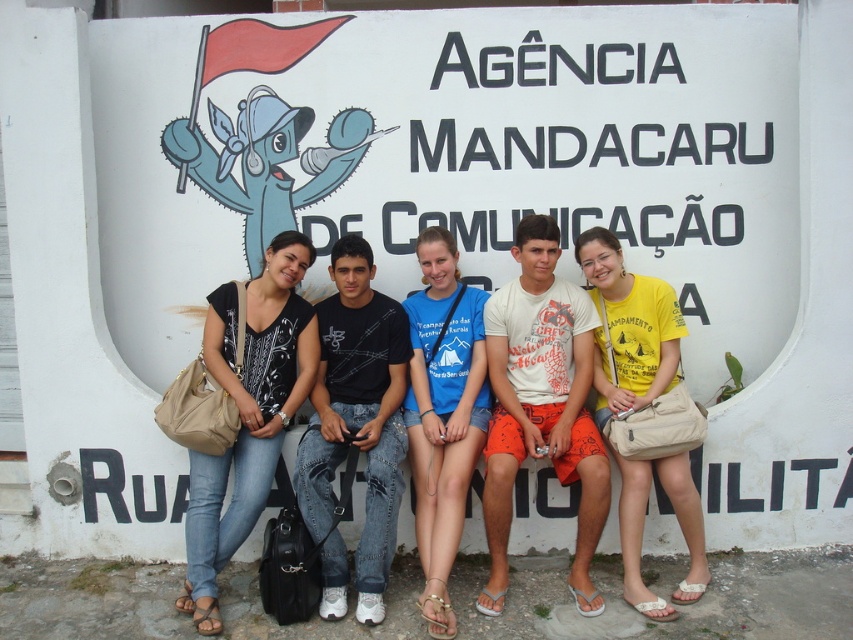
Which is more to the left, black cotton shirt at center or yellow cotton shirt at center?

Positioned to the left is black cotton shirt at center.

Does point (399, 403) lie in front of point (602, 234)?

Yes.

Who is more forward, (x=389, y=465) or (x=627, y=490)?

Point (x=389, y=465) is in front.

In order to click on black cotton shirt at center in this screenshot , I will do `click(355, 428)`.

Looking at this image, between blue cotton t-shirt at center and yellow cotton shirt at center, which one has more height?

Standing taller between the two is blue cotton t-shirt at center.

Is the position of blue cotton t-shirt at center more distant than that of yellow cotton shirt at center?

No, it is in front of yellow cotton shirt at center.

At what (x,y) coordinates should I click in order to perform the action: click on blue cotton t-shirt at center. Please return your answer as a coordinate pair (x, y). Looking at the image, I should click on (444, 413).

Where is `blue cotton t-shirt at center`? blue cotton t-shirt at center is located at coordinates (444, 413).

Between point (248, 282) and point (641, 481), which one is positioned in front?

Point (641, 481)

Does black printed blouse at left have a lesser width compared to yellow cotton shirt at center?

Incorrect, black printed blouse at left's width is not less than yellow cotton shirt at center's.

Is point (277, 436) farther from viewer compared to point (634, 548)?

That is True.

What are the coordinates of `black printed blouse at left` in the screenshot? It's located at (247, 412).